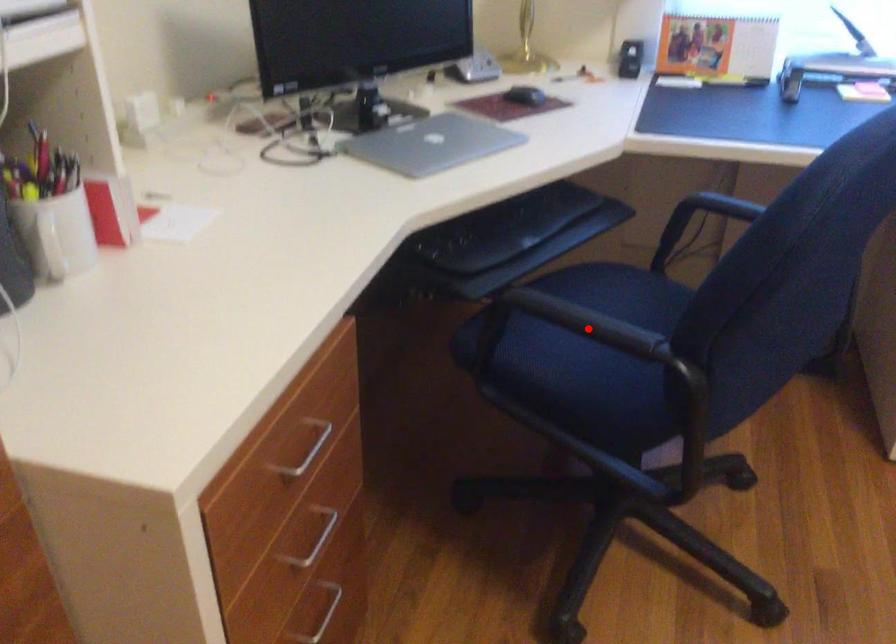
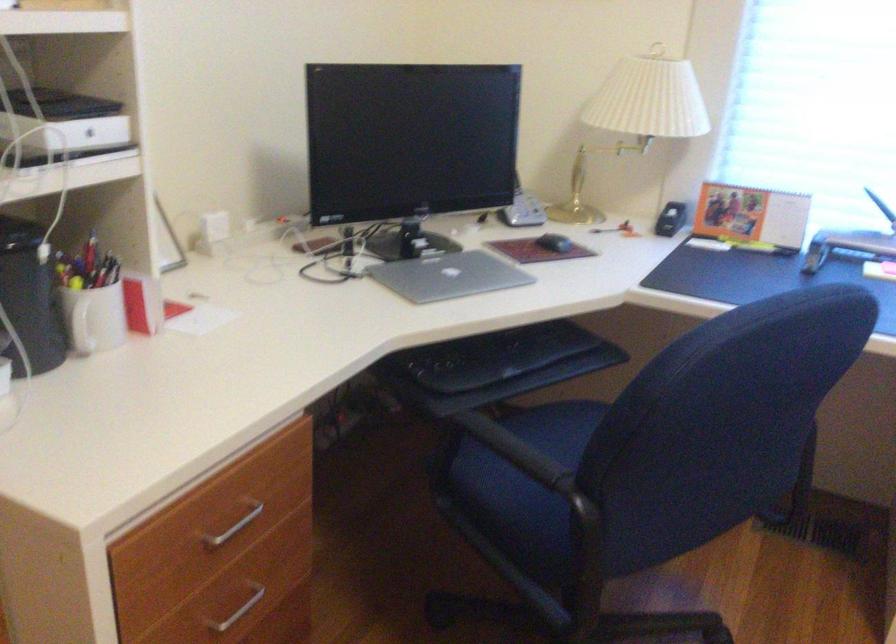
Question: I am providing you with two images of the same scene from different viewpoints. Image1 has a red point marked. In image2, the corresponding 3D location appears at what relative position? Reply with the corresponding letter.

Choices:
 (A) Closer
 (B) Farther

Answer: (B)